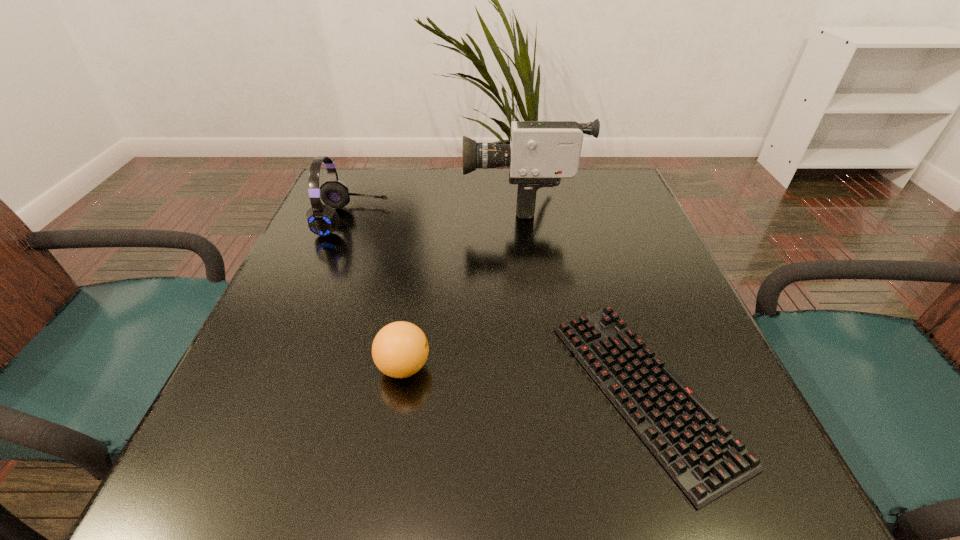
Locate an element on the screen. The height and width of the screenshot is (540, 960). vacant space that is in between the shortest object and the tallest object is located at coordinates (583, 295).

Find the location of a particular element. The image size is (960, 540). unoccupied position between the computer keyboard and the ping-pong ball is located at coordinates (523, 379).

The height and width of the screenshot is (540, 960). Find the location of `vacant space in between the camcorder and the ping-pong ball`. vacant space in between the camcorder and the ping-pong ball is located at coordinates (463, 284).

I want to click on free space between the computer keyboard and the third object from right to left, so click(x=523, y=379).

The width and height of the screenshot is (960, 540). Identify the location of vacant area between the computer keyboard and the second tallest object. (498, 306).

Where is `free space between the camcorder and the computer keyboard`? The image size is (960, 540). free space between the camcorder and the computer keyboard is located at coordinates coord(583,295).

Where is `free space that is in between the shortest object and the camcorder`? This screenshot has height=540, width=960. free space that is in between the shortest object and the camcorder is located at coordinates (583, 295).

The image size is (960, 540). I want to click on vacant area that lies between the leftmost object and the computer keyboard, so click(498, 306).

Identify the location of vacant area that lies between the computer keyboard and the leftmost object. (498, 306).

Choose which object is the nearest neighbor to the second shortest object. Please provide its 2D coordinates. Your answer should be formatted as a tuple, i.e. [(x, y)], where the tuple contains the x and y coordinates of a point satisfying the conditions above.

[(700, 453)]